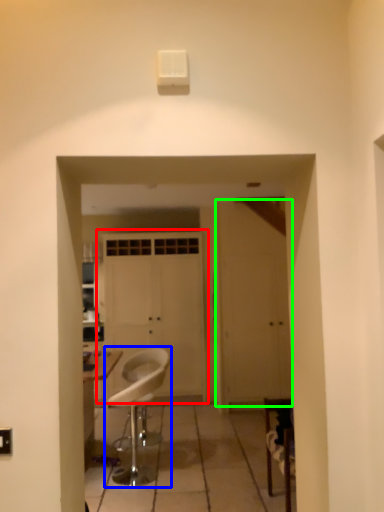
Question: Which is nearer to the door (highlighted by a red box)? chair (highlighted by a blue box) or door (highlighted by a green box).

Choices:
 (A) chair
 (B) door

Answer: (B)